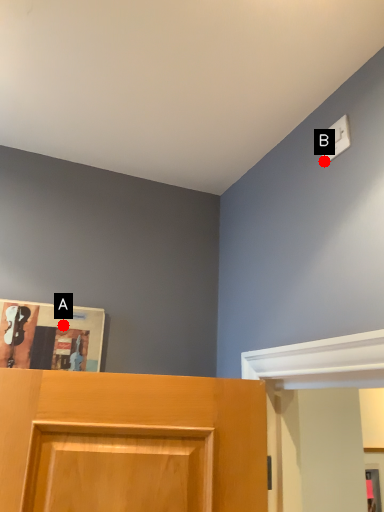
Question: Two points are circled on the image, labeled by A and B beside each circle. Which of the following is the closest to the observer?

Choices:
 (A) A is closer
 (B) B is closer

Answer: (B)